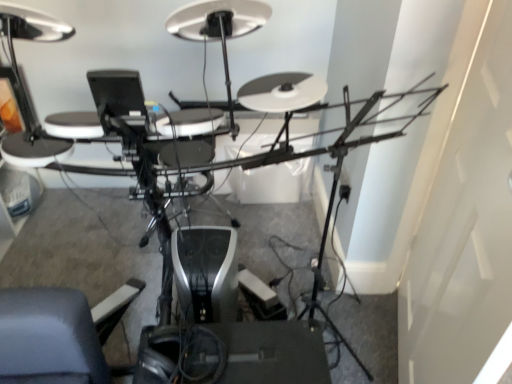
Describe the element at coordinates (233, 354) in the screenshot. I see `black plastic table at lower center` at that location.

Image resolution: width=512 pixels, height=384 pixels. Identify the location of black plastic table at lower center. (233, 354).

The width and height of the screenshot is (512, 384). What are the coordinates of `black plastic table at lower center` in the screenshot? It's located at (233, 354).